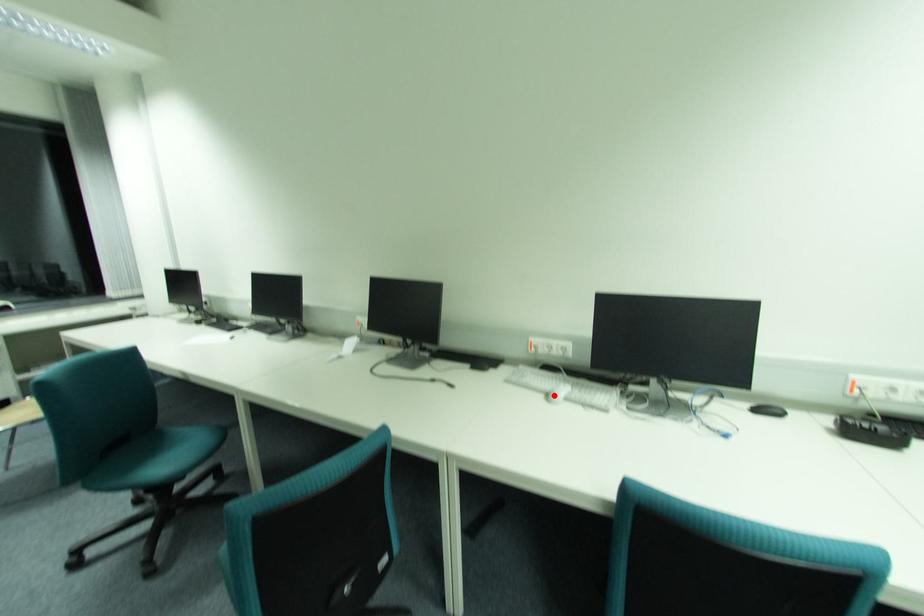
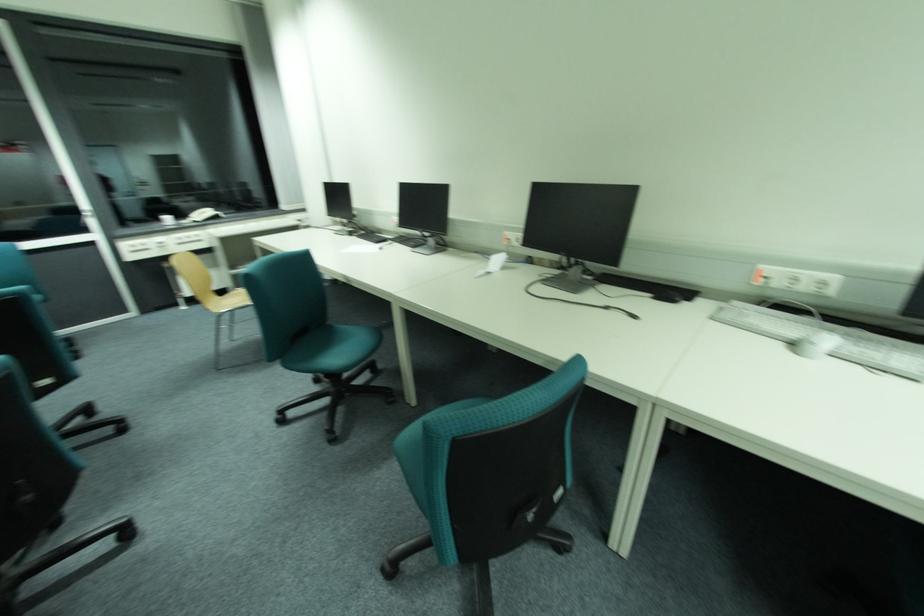
The point at the highlighted location is marked in the first image. Where is the corresponding point in the second image?

(800, 345)